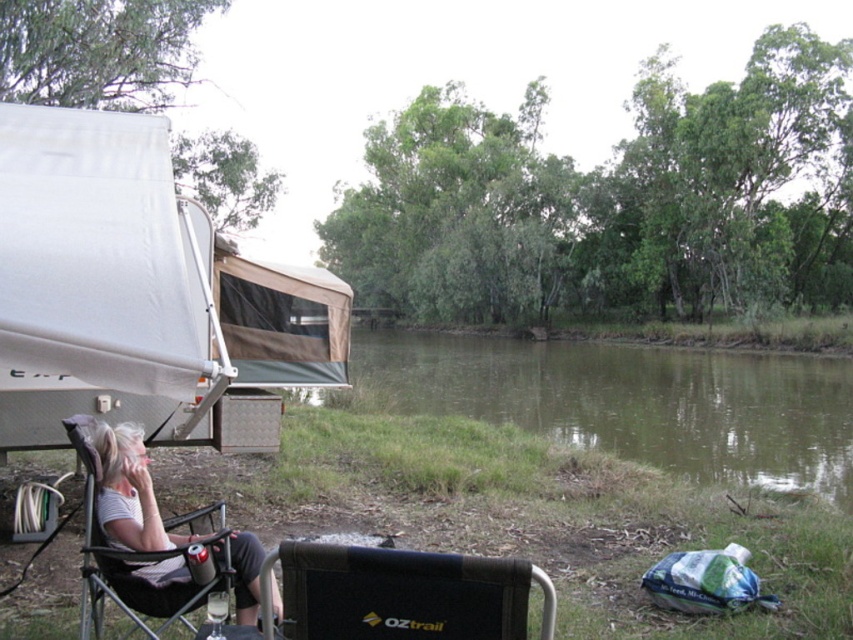
Which is more to the right, black fabric chair at lower center or gray fabric chair at lower left?

From the viewer's perspective, black fabric chair at lower center appears more on the right side.

Is black fabric chair at lower center bigger than gray fabric chair at lower left?

No, black fabric chair at lower center is not bigger than gray fabric chair at lower left.

Does point (328, 614) lie in front of point (125, 452)?

Yes, it is in front of point (125, 452).

At what (x,y) coordinates should I click in order to perform the action: click on black fabric chair at lower center. Please return your answer as a coordinate pair (x, y). Image resolution: width=853 pixels, height=640 pixels. Looking at the image, I should click on (402, 593).

Is green grassy riverbank at center positioned at the back of black fabric chair at lower center?

Yes, it is.

Does green grassy riverbank at center have a larger size compared to black fabric chair at lower center?

Yes, green grassy riverbank at center is bigger than black fabric chair at lower center.

Is point (784, 369) more distant than point (378, 605)?

Yes, it is behind point (378, 605).

Where is `green grassy riverbank at center`? The width and height of the screenshot is (853, 640). green grassy riverbank at center is located at coordinates 628,401.

Can you confirm if green grassy riverbank at center is positioned to the right of gray fabric chair at lower left?

Yes, green grassy riverbank at center is to the right of gray fabric chair at lower left.

How much distance is there between green grassy riverbank at center and gray fabric chair at lower left?

green grassy riverbank at center is 60.64 feet from gray fabric chair at lower left.

Identify the location of green grassy riverbank at center. (628, 401).